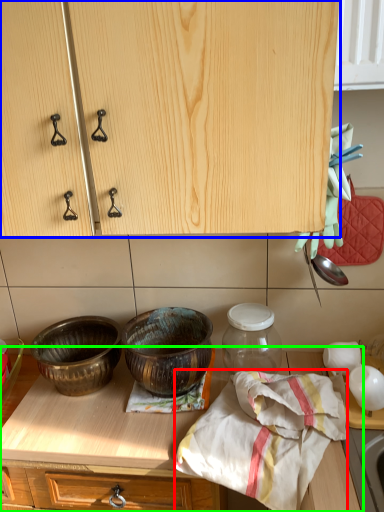
Question: Which object is positioned closest to blanket (highlighted by a red box)? Select from cabinetry (highlighted by a blue box) and countertop (highlighted by a green box).

Choices:
 (A) cabinetry
 (B) countertop

Answer: (B)